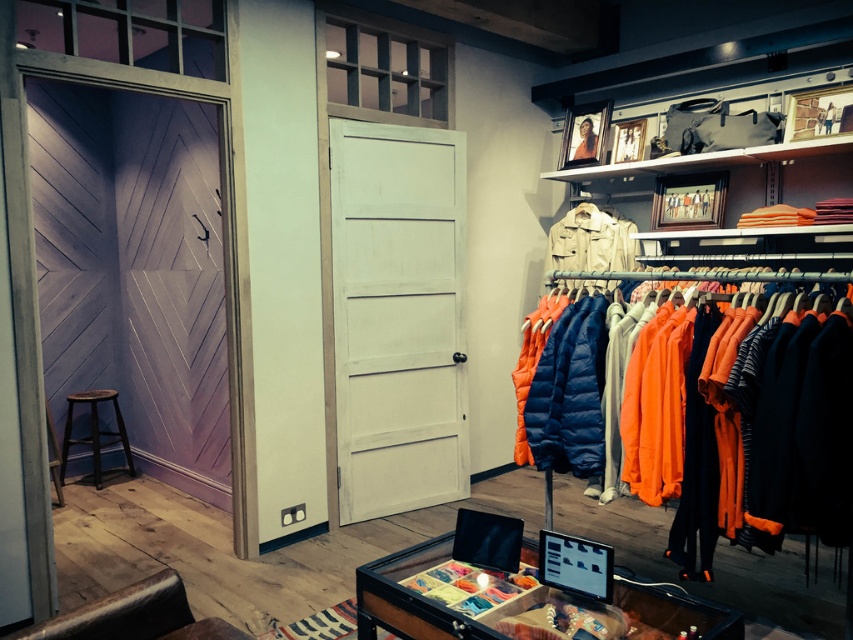
Question: From the image, what is the correct spatial relationship of khaki canvas jacket at center in relation to black wood stool at lower left?

Choices:
 (A) below
 (B) above

Answer: (B)

Question: Which is nearer to the khaki canvas jacket at center?

Choices:
 (A) orange quilted jacket at right
 (B) black wood stool at lower left

Answer: (A)

Question: Which point is farther from the camera taking this photo?

Choices:
 (A) [x=564, y=280]
 (B) [x=711, y=385]
 (C) [x=68, y=435]

Answer: (C)

Question: Which point is farther from the camera taking this photo?

Choices:
 (A) (622, 236)
 (B) (724, 353)
 (C) (64, 428)

Answer: (C)

Question: Does orange quilted jacket at right appear on the left side of black wood stool at lower left?

Choices:
 (A) no
 (B) yes

Answer: (A)

Question: Does orange quilted jacket at right have a larger size compared to black wood stool at lower left?

Choices:
 (A) no
 (B) yes

Answer: (B)